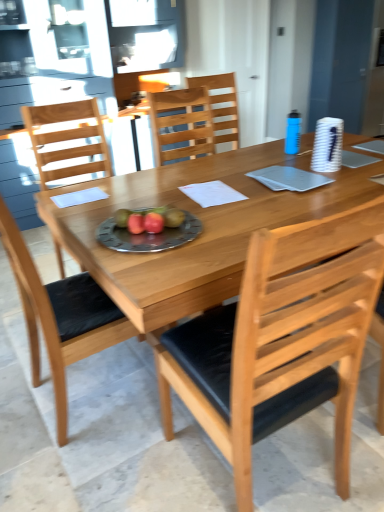
Image resolution: width=384 pixels, height=512 pixels. What are the coordinates of `vacant area located to the right-hand side of metallic silver plate with fruits at center` in the screenshot? It's located at (218, 227).